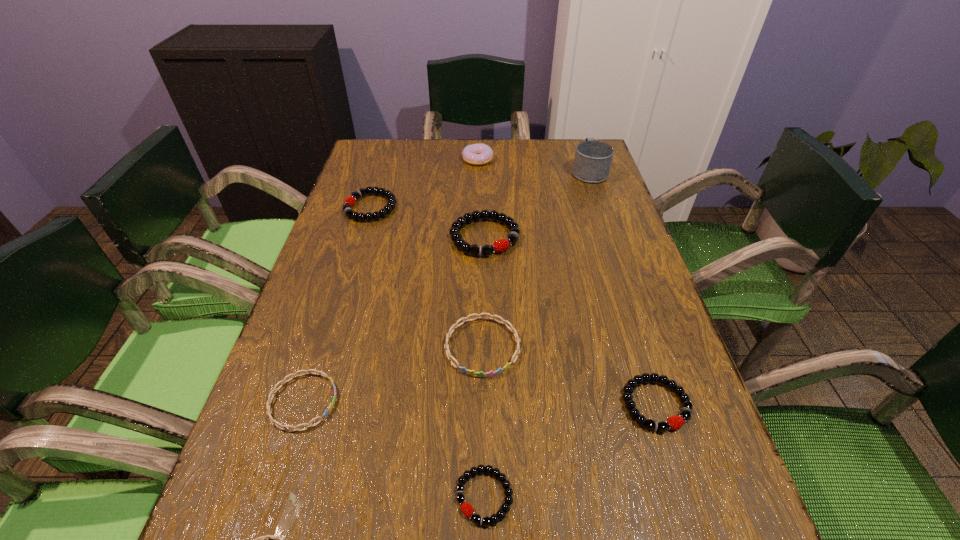
I want to click on the smallest black bracelet, so click(x=466, y=508).

This screenshot has height=540, width=960. In order to click on vacant space located 0.100m on the side of the tallest object with the handle in this screenshot , I will do `click(580, 144)`.

Identify the location of free space located on the right of the second tallest object. This screenshot has height=540, width=960. pos(556,159).

Where is `vacant space located 0.070m on the front of the seventh shortest object`? This screenshot has height=540, width=960. vacant space located 0.070m on the front of the seventh shortest object is located at coordinates (486, 280).

Identify the location of free space located on the back of the second biggest black bracelet. This screenshot has height=540, width=960. (391, 143).

The image size is (960, 540). In order to click on free space located on the surface of the rightmost blue bracelet showing star-shaped elements in this screenshot , I will do tap(483, 441).

The image size is (960, 540). In order to click on vacant space located 0.300m on the back of the rightmost black bracelet in this screenshot , I will do `click(612, 268)`.

At what (x,y) coordinates should I click in order to perform the action: click on vacant space situated 0.110m on the surface of the second biggest blue bracelet showing star-shaped elements. Please return your answer as a coordinate pair (x, y). The width and height of the screenshot is (960, 540). Looking at the image, I should click on (397, 401).

This screenshot has width=960, height=540. What are the coordinates of `free spot located on the back of the second nearest object` in the screenshot? It's located at (484, 395).

Where is `mug at the far edge`? The image size is (960, 540). mug at the far edge is located at coordinates (593, 159).